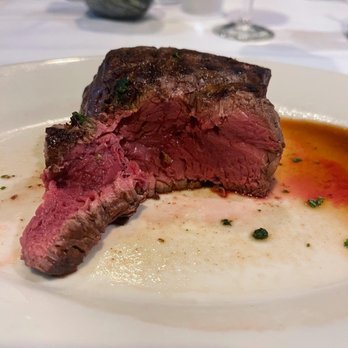
The height and width of the screenshot is (348, 348). What are the coordinates of `cream colored plate` in the screenshot? It's located at (98, 335), (36, 99), (307, 83).